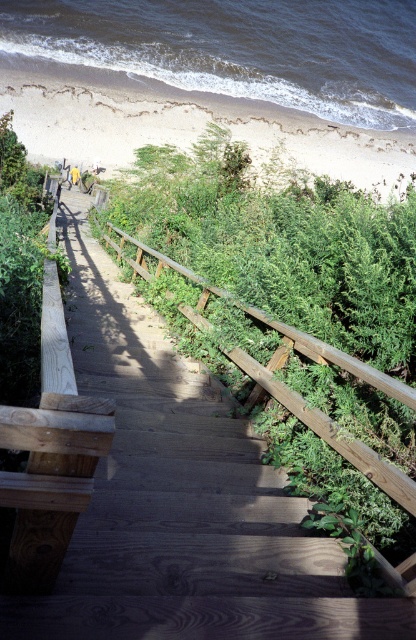
Question: Can you confirm if white sandy beach at upper left is smaller than wooden rail at center?

Choices:
 (A) no
 (B) yes

Answer: (A)

Question: Is white sandy beach at upper left to the left of wooden rail at center from the viewer's perspective?

Choices:
 (A) no
 (B) yes

Answer: (A)

Question: Which point appears farthest from the camera in this image?

Choices:
 (A) (391, 573)
 (B) (309, 134)

Answer: (B)

Question: Does white sandy beach at upper left have a larger size compared to wooden rail at center?

Choices:
 (A) no
 (B) yes

Answer: (B)